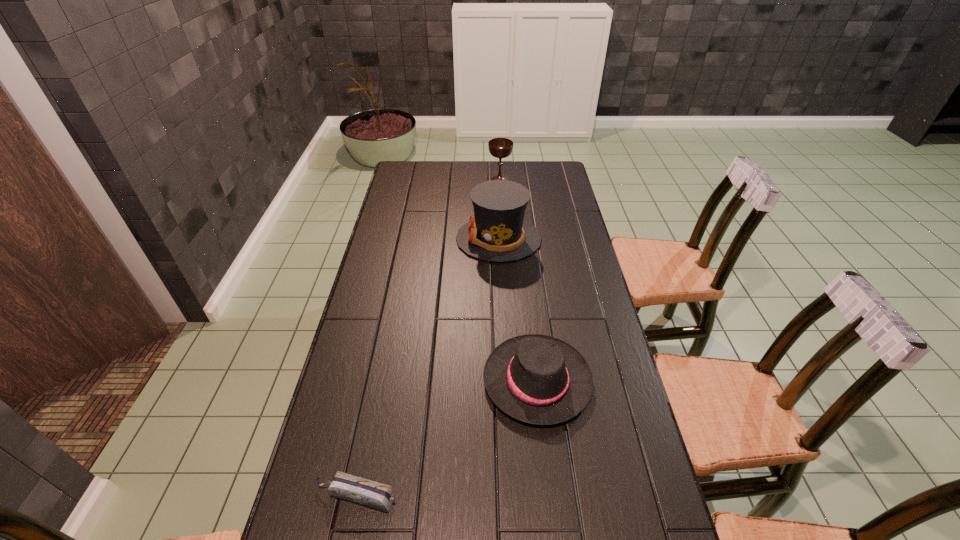
You are a GUI agent. You are given a task and a screenshot of the screen. Output one action in this format:
    pyautogui.click(x=<x>, y=<y>)
    Task: Click on the taller dress hat
    The height and width of the screenshot is (540, 960).
    Given the screenshot: What is the action you would take?
    pyautogui.click(x=497, y=232)

In order to click on the farther dress hat in this screenshot , I will do `click(497, 232)`.

Identify the location of the farthest object. (500, 148).

The image size is (960, 540). In order to click on the shorter dress hat in this screenshot , I will do `click(538, 379)`.

The image size is (960, 540). I want to click on the second shortest object, so click(x=538, y=379).

At what (x,y) coordinates should I click in order to perform the action: click on the leftmost object. Please return your answer as a coordinate pair (x, y). Looking at the image, I should click on (376, 495).

Image resolution: width=960 pixels, height=540 pixels. In order to click on the shortest object in this screenshot , I will do `click(376, 495)`.

At what (x,y) coordinates should I click in order to perform the action: click on free location located with goggles on the front of the farther dress hat. Please return your answer as a coordinate pair (x, y). The image size is (960, 540). Looking at the image, I should click on (424, 239).

Locate an element on the screen. Image resolution: width=960 pixels, height=540 pixels. free region located with goggles on the front of the farther dress hat is located at coordinates (414, 239).

Locate an element on the screen. This screenshot has width=960, height=540. vacant region located 0.250m with goggles on the front of the farther dress hat is located at coordinates (391, 239).